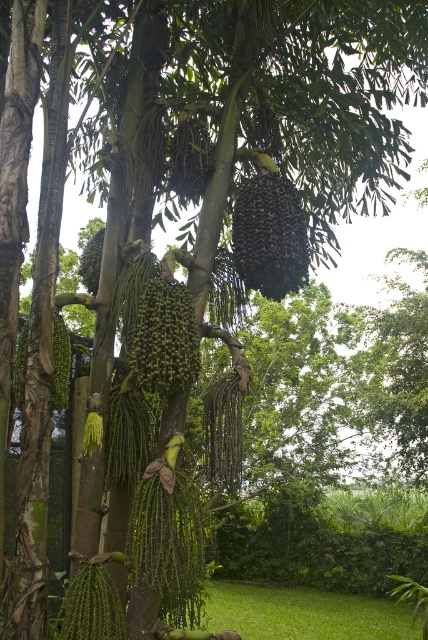
Question: Which point appears closest to the camera in this image?

Choices:
 (A) (83, 282)
 (B) (303, 241)
 (C) (56, 387)

Answer: (B)

Question: Is green matte palm fruit at upper center to the left of green matte palm fruit at center-left from the viewer's perspective?

Choices:
 (A) no
 (B) yes

Answer: (A)

Question: Which point is farther to the camera?

Choices:
 (A) green matte palm fruit at upper center
 (B) green matte palm fruit at center

Answer: (A)

Question: Based on their relative distances, which object is nearer to the green matte palm fruit at center-left?

Choices:
 (A) dark green glossy palm fruit at center
 (B) green matte palm fruit at center
 (C) green matte palm fruit at left

Answer: (C)

Question: Can you confirm if green matte palm fruit at center is positioned below green matte palm fruit at left?

Choices:
 (A) yes
 (B) no

Answer: (B)

Question: Can you confirm if green grass at lower center is wider than dark green glossy palm fruit at center?

Choices:
 (A) no
 (B) yes

Answer: (B)